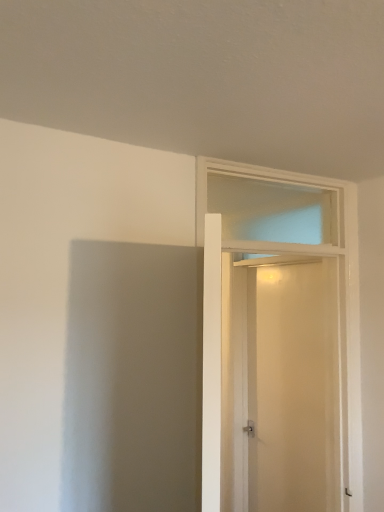
Question: Can you confirm if white glossy door at center is wider than beige matte screen door at center?

Choices:
 (A) yes
 (B) no

Answer: (A)

Question: Is beige matte screen door at center located within white glossy door at center?

Choices:
 (A) no
 (B) yes

Answer: (A)

Question: Is white glossy door at center smaller than beige matte screen door at center?

Choices:
 (A) no
 (B) yes

Answer: (A)

Question: Is white glossy door at center oriented away from beige matte screen door at center?

Choices:
 (A) no
 (B) yes

Answer: (B)

Question: Is white glossy door at center shorter than beige matte screen door at center?

Choices:
 (A) yes
 (B) no

Answer: (A)

Question: Is white glossy door at center not near beige matte screen door at center?

Choices:
 (A) no
 (B) yes

Answer: (A)

Question: From a real-world perspective, is beige matte screen door at center physically above white glossy door at center?

Choices:
 (A) yes
 (B) no

Answer: (B)

Question: From the image's perspective, is beige matte screen door at center located beneath white glossy door at center?

Choices:
 (A) no
 (B) yes

Answer: (B)

Question: From the image's perspective, does beige matte screen door at center appear higher than white glossy door at center?

Choices:
 (A) no
 (B) yes

Answer: (A)

Question: Are beige matte screen door at center and white glossy door at center beside each other?

Choices:
 (A) no
 (B) yes

Answer: (B)

Question: Is beige matte screen door at center not inside white glossy door at center?

Choices:
 (A) yes
 (B) no

Answer: (A)

Question: Does beige matte screen door at center have a greater height compared to white glossy door at center?

Choices:
 (A) no
 (B) yes

Answer: (B)

Question: Based on their sizes in the image, would you say white glossy door at center is bigger or smaller than beige matte screen door at center?

Choices:
 (A) big
 (B) small

Answer: (A)